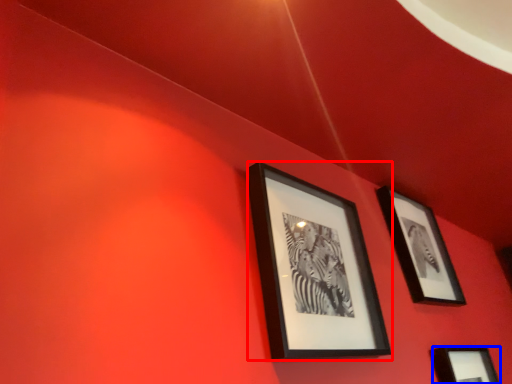
Question: Which object appears closest to the camera in this image, picture frame (highlighted by a red box) or picture frame (highlighted by a blue box)?

Choices:
 (A) picture frame
 (B) picture frame

Answer: (A)